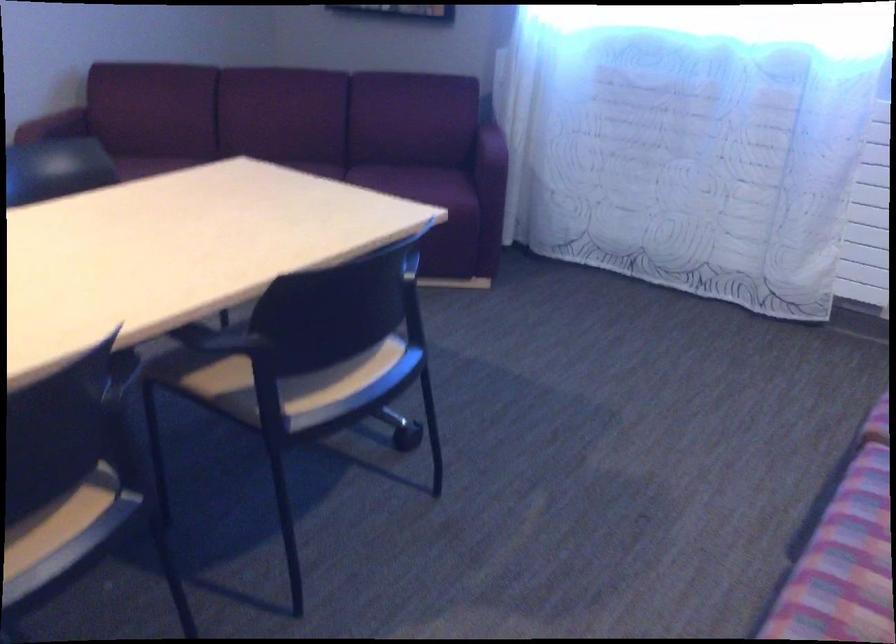
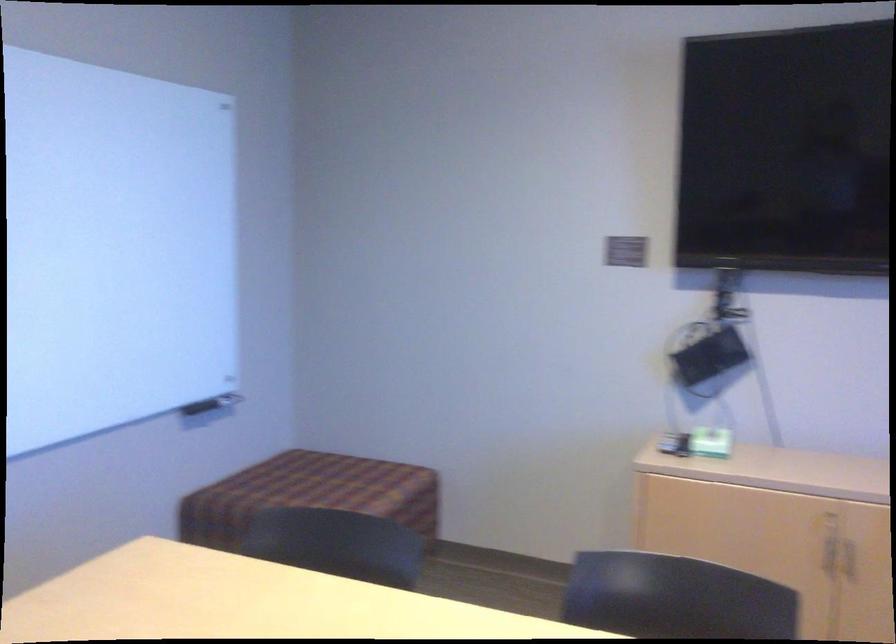
Question: How did the camera likely rotate?

Choices:
 (A) Left
 (B) Right
 (C) Up
 (D) Down

Answer: (A)